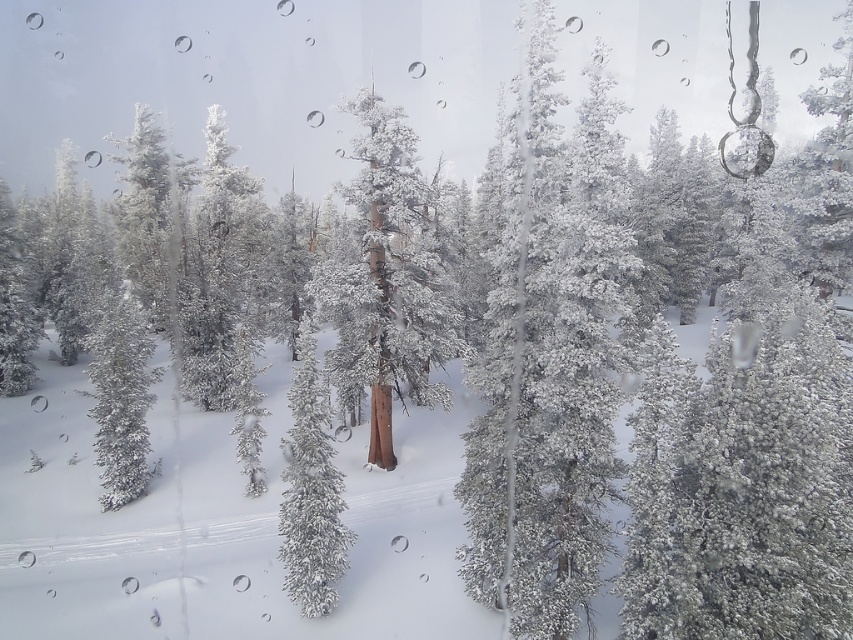
Which is more to the left, snow-covered pine at center or snow-covered tree at center?

Positioned to the left is snow-covered tree at center.

Which of these two, snow-covered pine at center or snow-covered tree at center, stands shorter?

snow-covered tree at center

Who is more distant from viewer, (572, 480) or (283, 545)?

The point (283, 545) is behind.

The image size is (853, 640). In order to click on snow-covered pine at center in this screenshot , I will do (548, 356).

Between snow-covered pine at center and snow-covered bark tree at center, which one appears on the right side from the viewer's perspective?

From the viewer's perspective, snow-covered pine at center appears more on the right side.

Does snow-covered pine at center appear over snow-covered bark tree at center?

Indeed, snow-covered pine at center is positioned over snow-covered bark tree at center.

The height and width of the screenshot is (640, 853). What do you see at coordinates (548, 356) in the screenshot? I see `snow-covered pine at center` at bounding box center [548, 356].

Identify the location of snow-covered pine at center. (548, 356).

In the scene shown: Who is higher up, snow-covered bark tree at center or snow-covered tree at center?

Positioned higher is snow-covered bark tree at center.

Based on the photo, between snow-covered bark tree at center and snow-covered tree at center, which one appears on the right side from the viewer's perspective?

From the viewer's perspective, snow-covered bark tree at center appears more on the right side.

At what (x,y) coordinates should I click in order to perform the action: click on snow-covered bark tree at center. Please return your answer as a coordinate pair (x, y). Image resolution: width=853 pixels, height=640 pixels. Looking at the image, I should click on (390, 278).